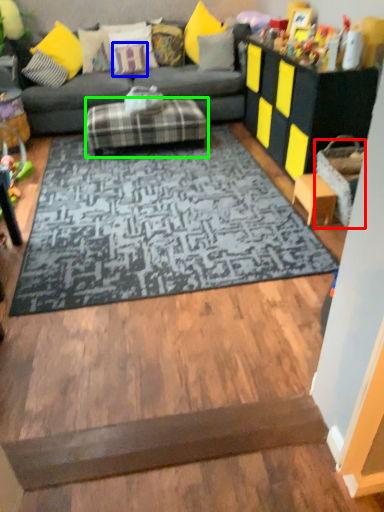
Question: Considering the real-world distances, which object is farthest from table (highlighted by a red box)? pillow (highlighted by a blue box) or footrest (highlighted by a green box)?

Choices:
 (A) pillow
 (B) footrest

Answer: (A)